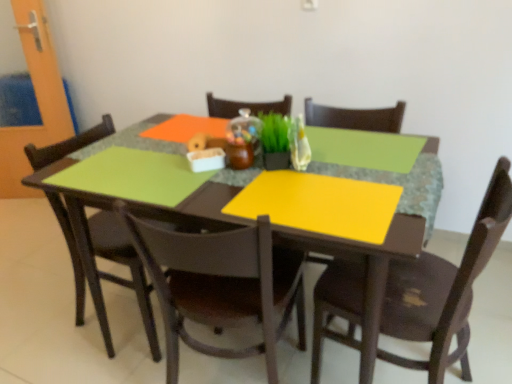
Where is `free space above matte wooden table at center (from a real-world perspective)`? The width and height of the screenshot is (512, 384). free space above matte wooden table at center (from a real-world perspective) is located at coordinates (263, 167).